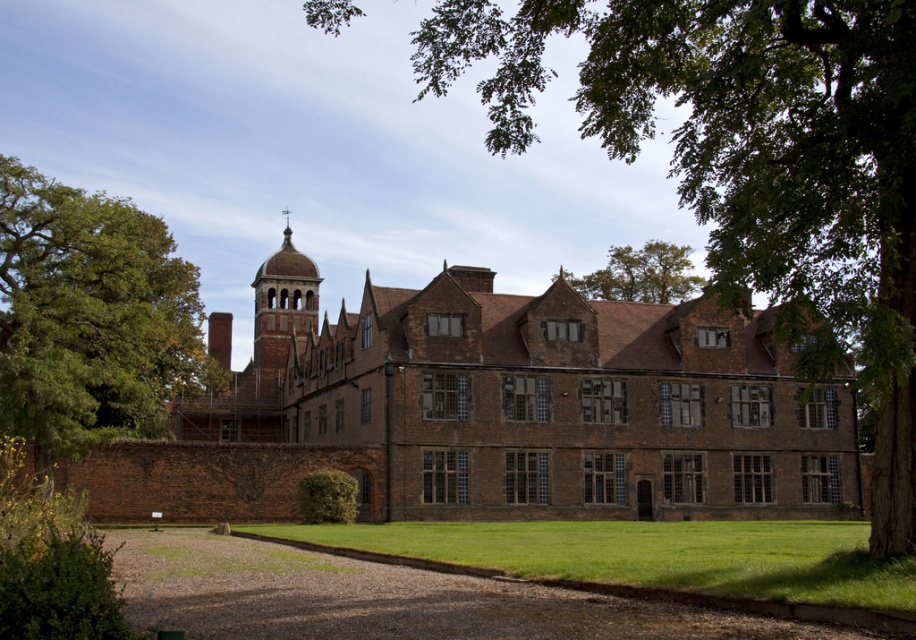
You are standing in front of the historic brick building. You notice two points marked on the building. The first point is at coordinate point (901, 323) and the second is at point (612, 275). Which point is closer to your current position?

Point (901, 323) is closer to the camera than point (612, 275), so the first point is closer to your current position.

You are standing in front of the historic brick building and notice two green leafy trees in the upper part of the image. Which tree is positioned closer to you, the green leafy tree at upper right or the green leafy tree at upper center?

The green leafy tree at upper right is closer to the viewer than the green leafy tree at upper center.